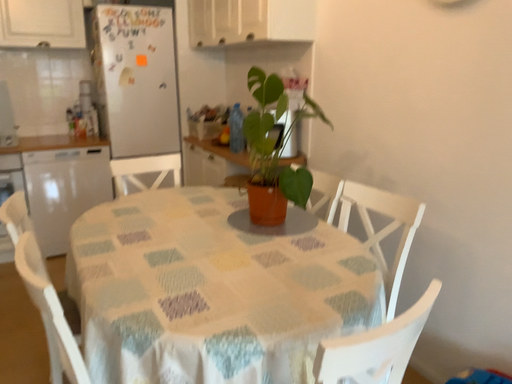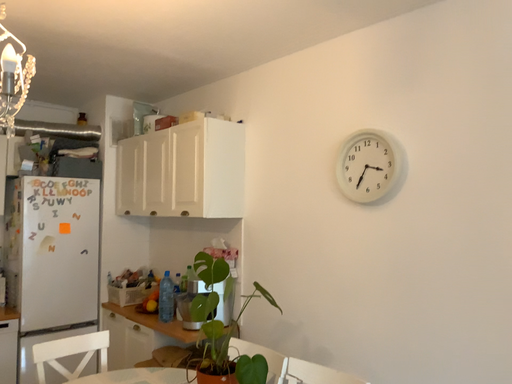
Question: How did the camera likely rotate when shooting the video?

Choices:
 (A) rotated right
 (B) rotated left

Answer: (A)